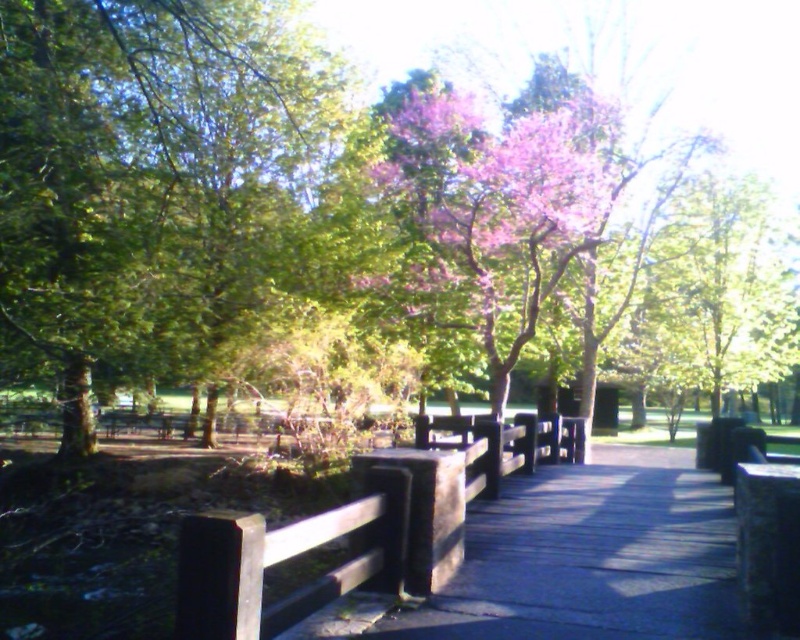
Question: Can you confirm if wooden bridge at center is wider than pink silky flowers at center?

Choices:
 (A) yes
 (B) no

Answer: (B)

Question: In this image, where is wooden bridge at center located relative to brown wood rail at center?

Choices:
 (A) right
 (B) left

Answer: (A)

Question: Among these objects, which one is farthest from the camera?

Choices:
 (A) wooden bridge at center
 (B) brown wood rail at center

Answer: (B)

Question: Can you confirm if wooden bridge at center is wider than pink silky flowers at center?

Choices:
 (A) no
 (B) yes

Answer: (A)

Question: Estimate the real-world distances between objects in this image. Which object is closer to the wooden bridge at center?

Choices:
 (A) brown wood rail at center
 (B) pink silky flowers at center

Answer: (A)

Question: Estimate the real-world distances between objects in this image. Which object is farther from the wooden bridge at center?

Choices:
 (A) brown wood rail at center
 (B) pink silky flowers at center

Answer: (B)